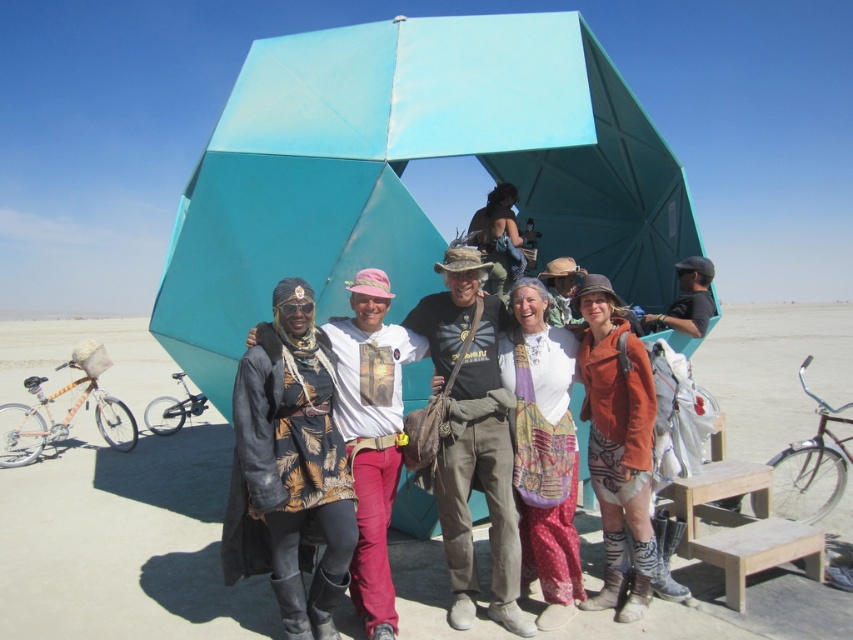
Question: Which of these objects is positioned closest to the leather jacket at center?

Choices:
 (A) matte orange jacket at center
 (B) matte black jacket at center

Answer: (B)

Question: Is teal fabric tent at center wider than matte orange jacket at center?

Choices:
 (A) yes
 (B) no

Answer: (B)

Question: Can you confirm if leather jacket at center is positioned below printed cotton skirt at center?

Choices:
 (A) yes
 (B) no

Answer: (B)

Question: Estimate the real-world distances between objects in this image. Which object is farther from the leather jacket at center?

Choices:
 (A) light brown wooden picnic table at center
 (B) brown canvas bag at center

Answer: (A)

Question: Which object appears closest to the camera in this image?

Choices:
 (A) leather jacket at center
 (B) matte orange jacket at center

Answer: (A)

Question: Is brown canvas bag at center positioned in front of light brown wooden picnic table at center?

Choices:
 (A) yes
 (B) no

Answer: (A)